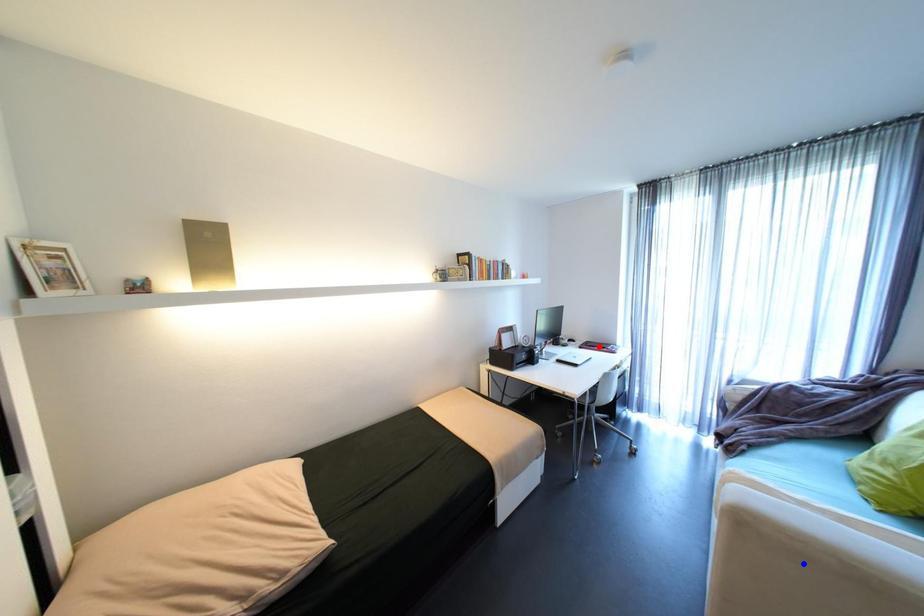
Question: In the image, two points are highlighted. Which point is nearer to the camera? Reply with the corresponding letter.

Choices:
 (A) blue point
 (B) red point

Answer: (A)